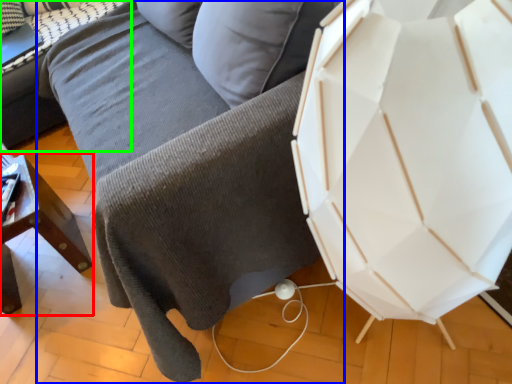
Question: Which object is positioned farthest from furniture (highlighted by a red box)? Select from studio couch (highlighted by a blue box) and table (highlighted by a green box).

Choices:
 (A) studio couch
 (B) table

Answer: (B)